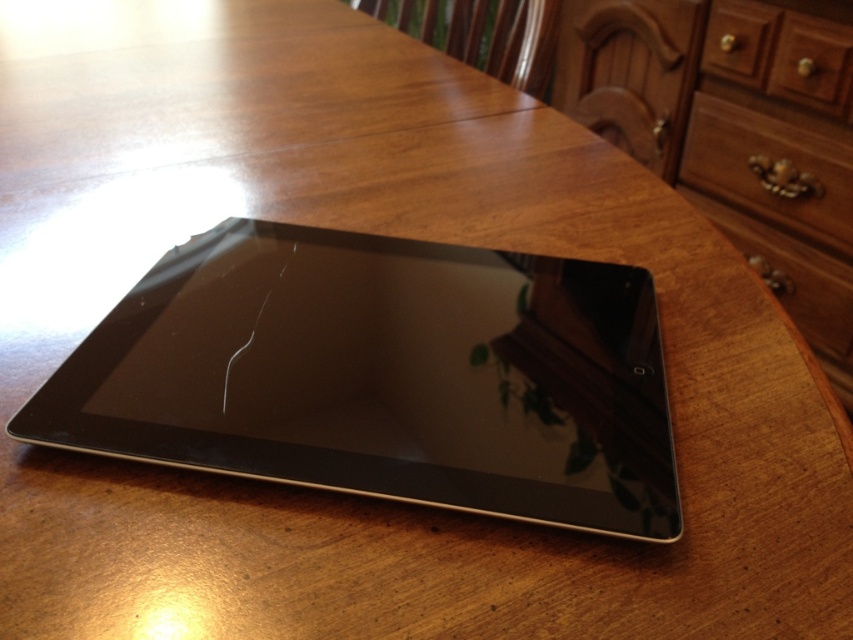
Question: Considering the relative positions of black glossy tablet at center and brown wood dresser at upper right in the image provided, where is black glossy tablet at center located with respect to brown wood dresser at upper right?

Choices:
 (A) above
 (B) below

Answer: (B)

Question: Which point is closer to the camera?

Choices:
 (A) black glossy tablet at center
 (B) brown wood drawer at upper right
 (C) wooden drawer at center

Answer: (A)

Question: Which of the following is the closest to the observer?

Choices:
 (A) (775, 20)
 (B) (518, 288)

Answer: (B)

Question: Does brown wood dresser at upper right appear on the right side of brown wood drawer at upper right?

Choices:
 (A) yes
 (B) no

Answer: (B)

Question: Which object is positioned closest to the black glossy tablet at center?

Choices:
 (A) brown wood dresser at upper right
 (B) wooden drawer at center

Answer: (A)

Question: Does brown wood dresser at upper right have a lesser width compared to wooden drawer at center?

Choices:
 (A) no
 (B) yes

Answer: (A)